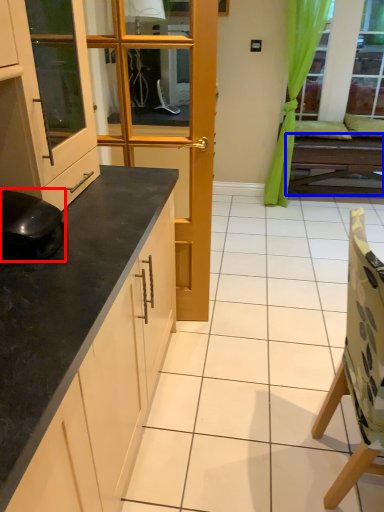
Question: Among these objects, which one is nearest to the camera, appliance (highlighted by a red box) or table (highlighted by a blue box)?

Choices:
 (A) appliance
 (B) table

Answer: (A)